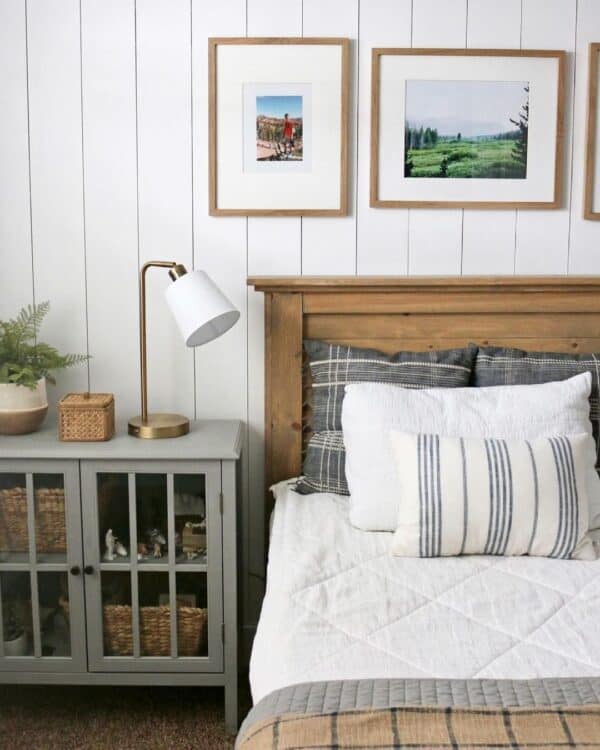
The height and width of the screenshot is (750, 600). I want to click on lamp, so click(187, 304).